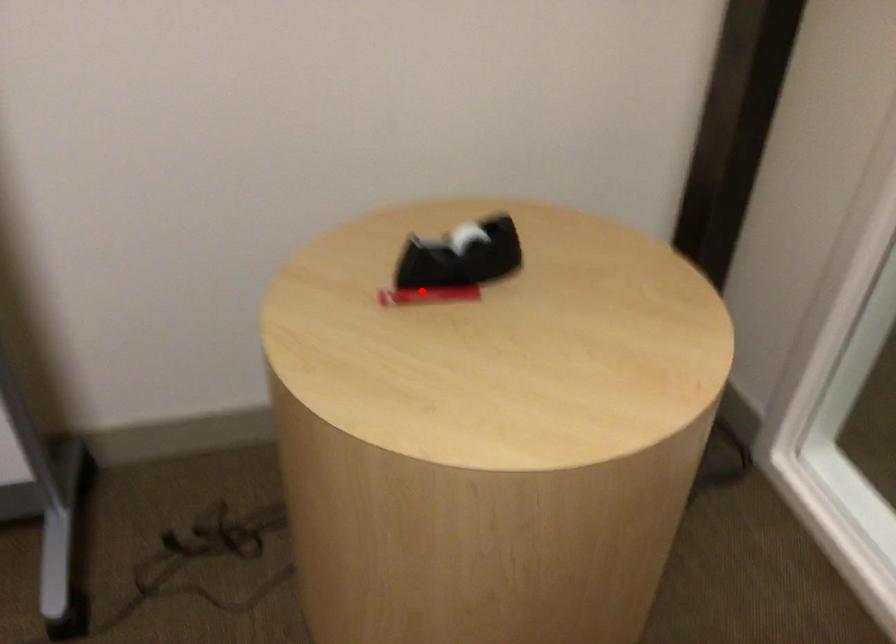
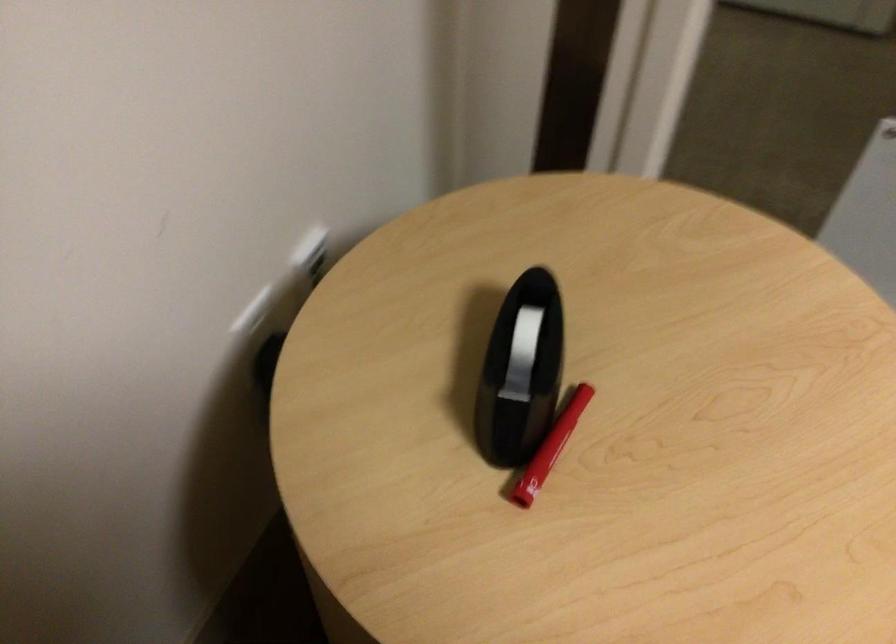
Where in the second image is the point corresponding to the highlighted location from the first image?

(557, 438)